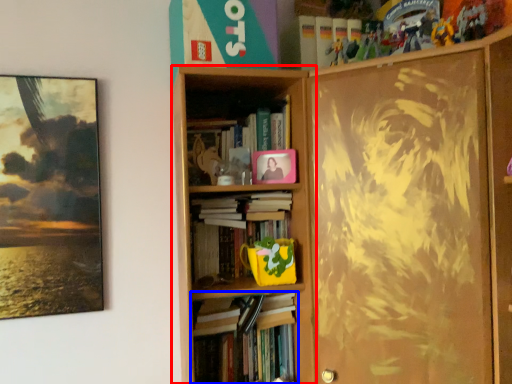
Question: Which point is further to the camera, bookcase (highlighted by a red box) or book (highlighted by a blue box)?

Choices:
 (A) bookcase
 (B) book

Answer: (B)